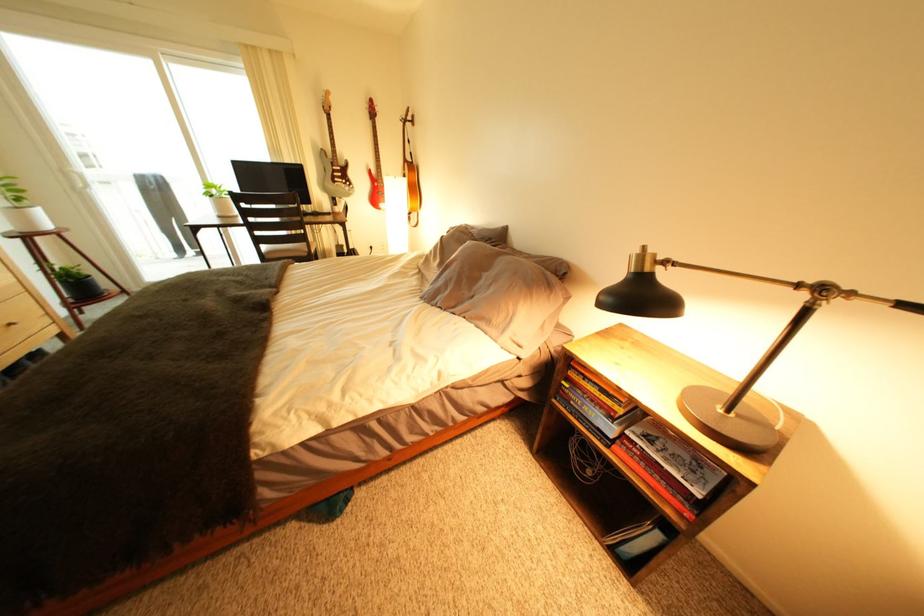
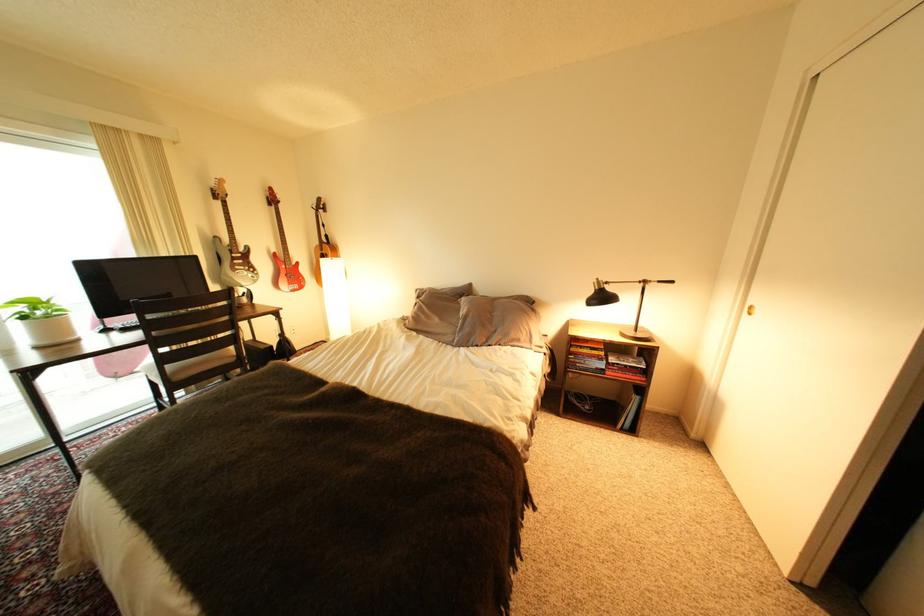
Where in the second image is the point corresponding to the point at 639,434 from the first image?

(623, 363)